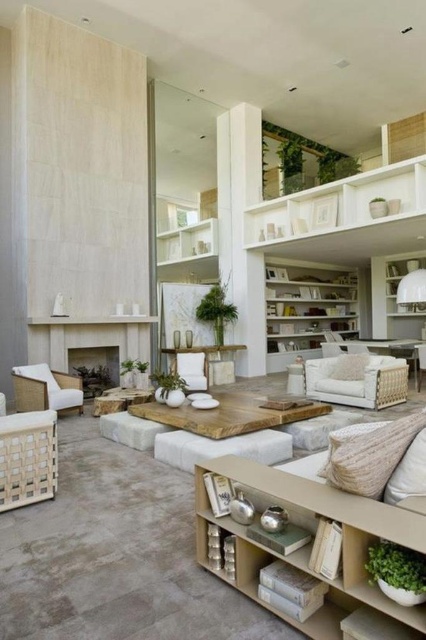
Can you confirm if white wicker armchair at center is smaller than white textured pillow at center?

Incorrect, white wicker armchair at center is not smaller in size than white textured pillow at center.

Does white wicker armchair at center appear on the left side of white textured pillow at center?

Correct, you'll find white wicker armchair at center to the left of white textured pillow at center.

Does point (377, 397) lie behind point (342, 358)?

No, it is not.

Where is `white wicker armchair at center`? The height and width of the screenshot is (640, 426). white wicker armchair at center is located at coordinates (357, 380).

Does white wood stool at center have a smaller size compared to white fabric armchair at center?

Yes, white wood stool at center is smaller than white fabric armchair at center.

Describe the element at coordinates (221, 448) in the screenshot. Image resolution: width=426 pixels, height=640 pixels. I see `white wood stool at center` at that location.

You are a GUI agent. You are given a task and a screenshot of the screen. Output one action in this format:
    pyautogui.click(x=<x>, y=<y>)
    Task: Click on the white wood stool at center
    The height and width of the screenshot is (640, 426).
    Given the screenshot: What is the action you would take?
    pyautogui.click(x=221, y=448)

You are a GUI agent. You are given a task and a screenshot of the screen. Output one action in this format:
    pyautogui.click(x=<x>, y=<y>)
    Task: Click on the white wood stool at center
    
    Given the screenshot: What is the action you would take?
    pyautogui.click(x=221, y=448)

Which of these two, white wood bookshelf at center or matte stone fireplace at center, stands shorter?

Standing shorter between the two is matte stone fireplace at center.

Which is behind, point (322, 292) or point (77, 356)?

Positioned behind is point (322, 292).

Who is more forward, (273, 320) or (77, 376)?

Positioned in front is point (77, 376).

Locate an element on the screen. This screenshot has width=426, height=640. white wood bookshelf at center is located at coordinates (305, 308).